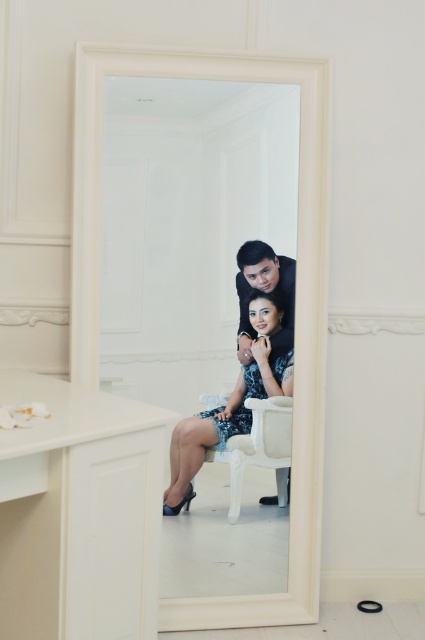
Question: Can you confirm if white glossy mirror at center is positioned below shiny blue dress at center?

Choices:
 (A) yes
 (B) no

Answer: (B)

Question: Can you confirm if white glossy mirror at center is wider than shiny blue dress at center?

Choices:
 (A) no
 (B) yes

Answer: (B)

Question: Which of the following is the closest to the observer?

Choices:
 (A) (314, 426)
 (B) (257, 332)

Answer: (B)

Question: Which point appears farthest from the camera in this image?

Choices:
 (A) (82, 314)
 (B) (184, 492)

Answer: (B)

Question: Does white glossy mirror at center come behind shiny blue dress at center?

Choices:
 (A) yes
 (B) no

Answer: (B)